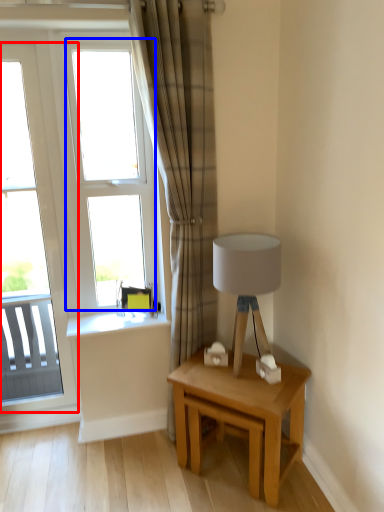
Question: Among these objects, which one is nearest to the camera, window (highlighted by a red box) or window (highlighted by a blue box)?

Choices:
 (A) window
 (B) window

Answer: (A)